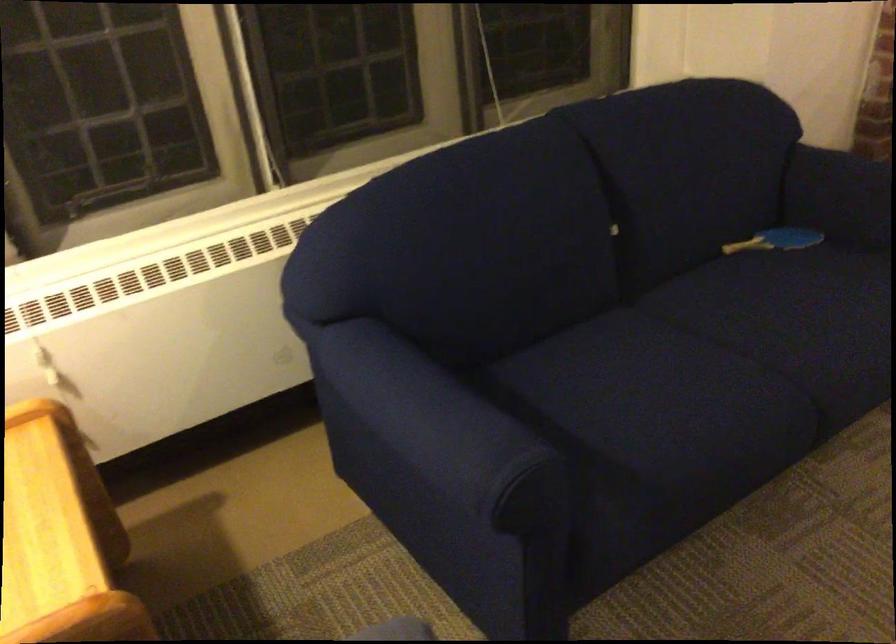
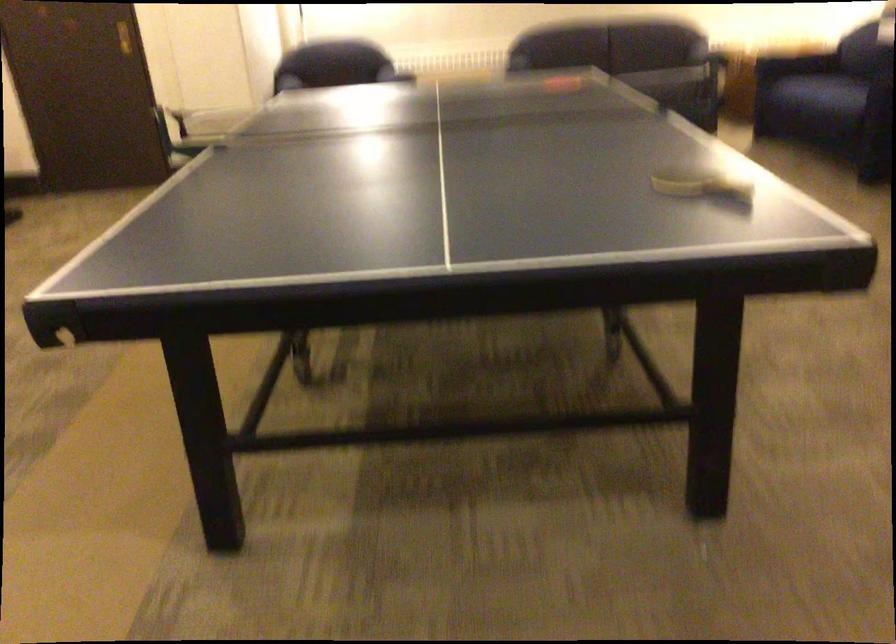
In the second image, find the point that corresponds to pixel 586 409 in the first image.

(794, 64)